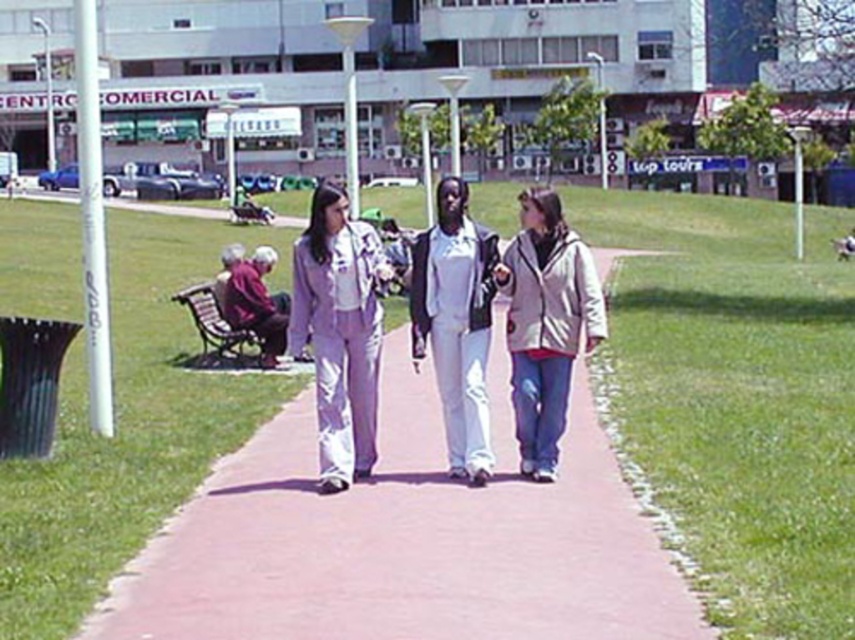
Consider the image. You are a photographer trying to capture a photo of the green grass at center and beige fleece jacket at center. Based on their positions, which object should you focus on first if you want to include both in the same frame without moving the camera?

The green grass at center is positioned on the left side of beige fleece jacket at center, so you should focus on the green grass at center first to ensure both are in the frame.

You are standing at the edge of the park and see the green grass at center and the beige fleece jacket at center. Which object is nearer to you?

The green grass at center is closer to the viewer than the beige fleece jacket at center.

You are a photographer setting up a tripod in the park. You need to ensure that both the matte white suit at center and the white matte pants at center are fully visible in your shot. Given their height difference, which object should you position closer to the camera to avoid cropping?

The matte white suit at center is shorter than the white matte pants at center. To ensure both are fully visible, position the matte white suit at center closer to the camera so its shorter height doesn not get cropped by the frame.